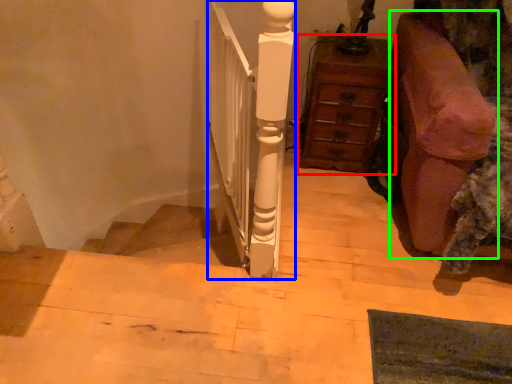
Question: Considering the real-world distances, which object is closest to chest of drawers (highlighted by a red box)? rail (highlighted by a blue box) or furniture (highlighted by a green box).

Choices:
 (A) rail
 (B) furniture

Answer: (B)